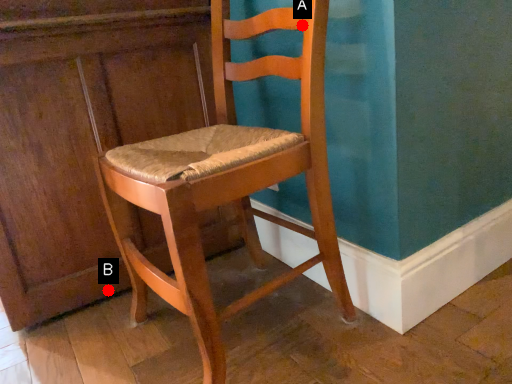
Question: Two points are circled on the image, labeled by A and B beside each circle. Which point appears farthest from the camera in this image?

Choices:
 (A) A is further
 (B) B is further

Answer: (B)